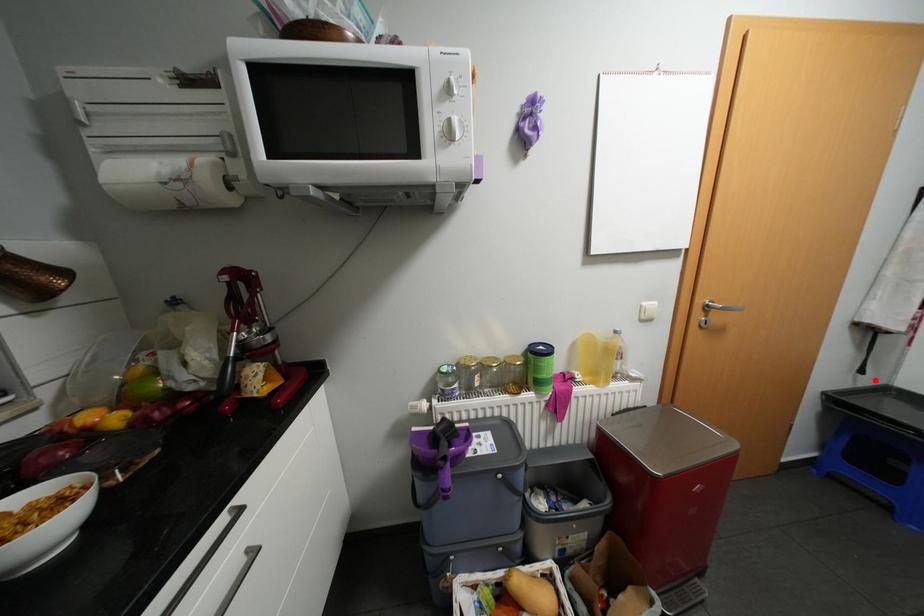
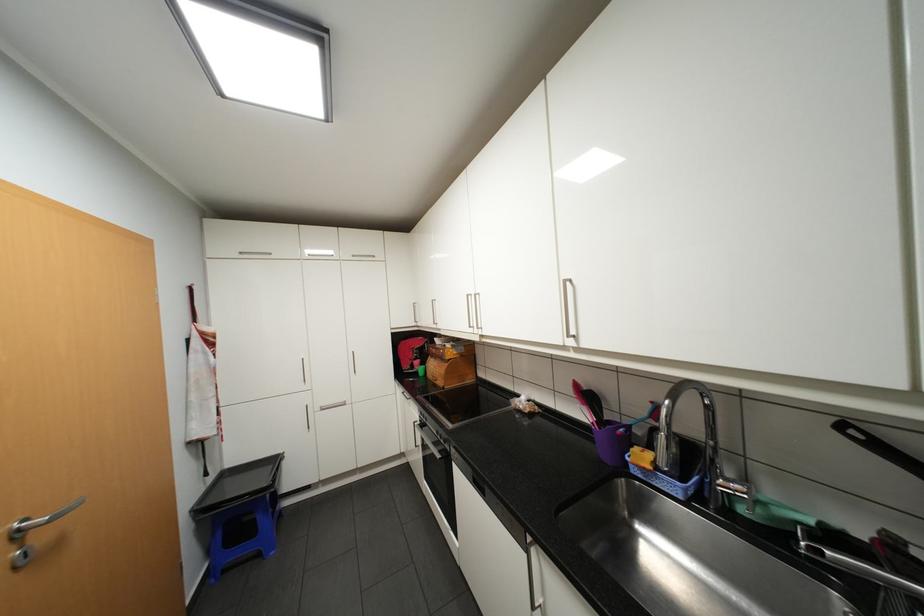
The point at the highlighted location is marked in the first image. Where is the corresponding point in the second image?

(220, 476)